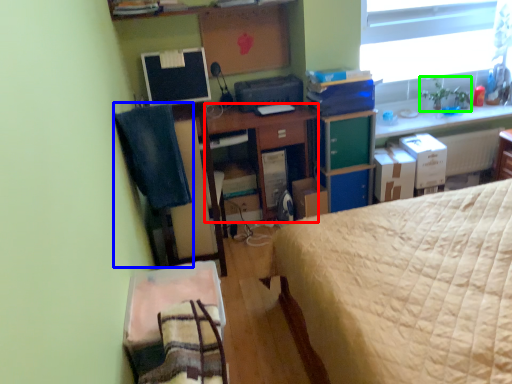
Question: Considering the real-world distances, which object is farthest from desk (highlighted by a red box)? computer chair (highlighted by a blue box) or houseplant (highlighted by a green box)?

Choices:
 (A) computer chair
 (B) houseplant

Answer: (B)